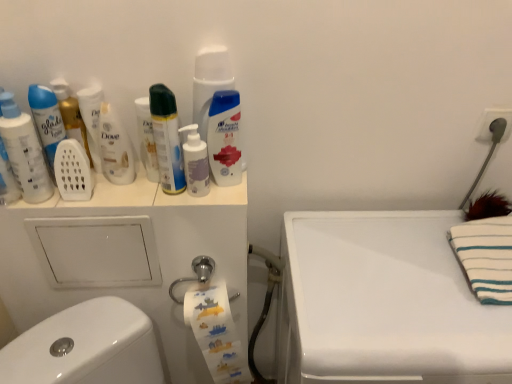
Measure the distance between white plastic electric outlet at upper right and camera.

They are 38.62 inches apart.

Find the location of a particular element. This screenshot has height=384, width=512. white striped towel at upper right is located at coordinates (486, 257).

Where is `matte white mouthwash at left, the 1th mouthwash from the left`? matte white mouthwash at left, the 1th mouthwash from the left is located at coordinates (24, 151).

What is the approximate width of white matte pump bottle at center, marked as the 2th mouthwash in a right-to-left arrangement?

The width of white matte pump bottle at center, marked as the 2th mouthwash in a right-to-left arrangement, is 2.26 inches.

Describe the element at coordinates (225, 138) in the screenshot. This screenshot has width=512, height=384. I see `translucent plastic mouthwash at center, positioned as the first mouthwash in right-to-left order` at that location.

Identify the location of white glossy counter top at upper right. (384, 303).

Where is `white plastic electric outlet at upper right`? white plastic electric outlet at upper right is located at coordinates (495, 123).

From the image's perspective, between white matte plastic mouthwash at upper left, placed as the 3th mouthwash when sorted from left to right, and white glossy counter top at upper right, who is located below?

white glossy counter top at upper right.

Is white matte plastic mouthwash at upper left, arranged as the fourth mouthwash when viewed from the right, turned away from white glossy counter top at upper right?

No, white matte plastic mouthwash at upper left, arranged as the fourth mouthwash when viewed from the right, is not facing away from white glossy counter top at upper right.

Is white glossy counter top at upper right inside white matte plastic mouthwash at upper left, placed as the 3th mouthwash when sorted from left to right?

Definitely not — white glossy counter top at upper right is not inside white matte plastic mouthwash at upper left, placed as the 3th mouthwash when sorted from left to right.

Is white matte plastic mouthwash at upper left, arranged as the fourth mouthwash when viewed from the right, taller than white glossy counter top at upper right?

Incorrect, the height of white matte plastic mouthwash at upper left, arranged as the fourth mouthwash when viewed from the right, is not larger of that of white glossy counter top at upper right.

From the image's perspective, does white glossy counter top at upper right appear higher than white matte pump bottle at center, the fifth mouthwash viewed from the left?

No, from the image's perspective, white glossy counter top at upper right is not over white matte pump bottle at center, the fifth mouthwash viewed from the left.

Is white glossy counter top at upper right oriented away from white matte pump bottle at center, marked as the 2th mouthwash in a right-to-left arrangement?

No, white glossy counter top at upper right's orientation is not away from white matte pump bottle at center, marked as the 2th mouthwash in a right-to-left arrangement.

Is white glossy counter top at upper right further to the viewer compared to white matte pump bottle at center, marked as the 2th mouthwash in a right-to-left arrangement?

That is False.

Consider the image. Considering the positions of objects white glossy counter top at upper right and white matte pump bottle at center, marked as the 2th mouthwash in a right-to-left arrangement, in the image provided, who is more to the right, white glossy counter top at upper right or white matte pump bottle at center, marked as the 2th mouthwash in a right-to-left arrangement,?

Positioned to the right is white glossy counter top at upper right.

From a real-world perspective, does white matte pump bottle at center, the fifth mouthwash viewed from the left, sit lower than white glossy toilet paper at center?

Actually, white matte pump bottle at center, the fifth mouthwash viewed from the left, is physically above white glossy toilet paper at center in the real world.

From the image's perspective, which one is positioned lower, white matte pump bottle at center, the fifth mouthwash viewed from the left, or white glossy toilet paper at center?

From the image's view, white glossy toilet paper at center is below.

In terms of height, does white matte pump bottle at center, the fifth mouthwash viewed from the left, look taller or shorter compared to white glossy toilet paper at center?

Clearly, white matte pump bottle at center, the fifth mouthwash viewed from the left, is shorter compared to white glossy toilet paper at center.

Based on the photo, which is more to the right, white matte pump bottle at center, the fifth mouthwash viewed from the left, or white glossy toilet paper at center?

white glossy toilet paper at center.

From a real-world perspective, is matte white mouthwash at left, arranged as the fifth mouthwash when viewed from the right, above or below white glossy toilet paper at center?

From a real-world perspective, matte white mouthwash at left, arranged as the fifth mouthwash when viewed from the right, is physically above white glossy toilet paper at center.

Can you confirm if matte white mouthwash at left, the second mouthwash positioned from the left, is wider than white glossy toilet paper at center?

No, matte white mouthwash at left, the second mouthwash positioned from the left, is not wider than white glossy toilet paper at center.

Based on their positions, is matte white mouthwash at left, arranged as the fifth mouthwash when viewed from the right, located to the left or right of white glossy toilet paper at center?

matte white mouthwash at left, arranged as the fifth mouthwash when viewed from the right, is positioned on white glossy toilet paper at center's left side.

From the image's perspective, relative to white glossy toilet paper at center, is matte white mouthwash at left, the second mouthwash positioned from the left, above or below?

matte white mouthwash at left, the second mouthwash positioned from the left, is above white glossy toilet paper at center.

Is white plastic electric outlet at upper right bigger than white matte pump bottle at center, the fifth mouthwash viewed from the left?

No.

Does white plastic electric outlet at upper right have a greater width compared to white matte pump bottle at center, marked as the 2th mouthwash in a right-to-left arrangement?

No.

Considering the relative positions of white plastic electric outlet at upper right and white matte pump bottle at center, marked as the 2th mouthwash in a right-to-left arrangement, in the image provided, is white plastic electric outlet at upper right to the left or to the right of white matte pump bottle at center, marked as the 2th mouthwash in a right-to-left arrangement,?

Clearly, white plastic electric outlet at upper right is on the right of white matte pump bottle at center, marked as the 2th mouthwash in a right-to-left arrangement, in the image.

Is white plastic electric outlet at upper right in front of or behind white matte pump bottle at center, marked as the 2th mouthwash in a right-to-left arrangement, in the image?

white plastic electric outlet at upper right is positioned farther from the viewer than white matte pump bottle at center, marked as the 2th mouthwash in a right-to-left arrangement.

In the image, is white striped towel at upper right on the left side or the right side of matte white mouthwash at left, arranged as the fifth mouthwash when viewed from the right?

In the image, white striped towel at upper right appears on the right side of matte white mouthwash at left, arranged as the fifth mouthwash when viewed from the right.

Is white striped towel at upper right spatially inside matte white mouthwash at left, arranged as the fifth mouthwash when viewed from the right, or outside of it?

The correct answer is: outside.

Considering the sizes of objects white striped towel at upper right and matte white mouthwash at left, arranged as the fifth mouthwash when viewed from the right, in the image provided, who is taller, white striped towel at upper right or matte white mouthwash at left, arranged as the fifth mouthwash when viewed from the right,?

matte white mouthwash at left, arranged as the fifth mouthwash when viewed from the right, is taller.

Considering the sizes of matte white mouthwash at left, arranged as the fifth mouthwash when viewed from the right, and white plastic electric outlet at upper right in the image, is matte white mouthwash at left, arranged as the fifth mouthwash when viewed from the right, wider or thinner than white plastic electric outlet at upper right?

Considering their sizes, matte white mouthwash at left, arranged as the fifth mouthwash when viewed from the right, looks broader than white plastic electric outlet at upper right.

From a real-world perspective, between matte white mouthwash at left, the second mouthwash positioned from the left, and white plastic electric outlet at upper right, who is vertically lower?

white plastic electric outlet at upper right, from a real-world perspective.

The width and height of the screenshot is (512, 384). I want to click on electric outlet above the matte white mouthwash at left, the second mouthwash positioned from the left (from the image's perspective), so click(495, 123).

From the image's perspective, does matte white mouthwash at left, the second mouthwash positioned from the left, appear lower than white plastic electric outlet at upper right?

Yes.

In the image, there is a white matte plastic mouthwash at upper left, placed as the 3th mouthwash when sorted from left to right. At what (x,y) coordinates should I click in order to perform the action: click on counter top below it (from the image's perspective). Please return your answer as a coordinate pair (x, y). Looking at the image, I should click on (384, 303).

Locate an element on the screen. This screenshot has height=384, width=512. counter top lying in front of the white matte pump bottle at center, the fifth mouthwash viewed from the left is located at coordinates (384, 303).

Looking at this image, which object lies nearer to the anchor point white matte plastic mouthwash at upper left, placed as the 3th mouthwash when sorted from left to right, translucent plastic mouthwash at center, the fourth mouthwash in the left-to-right sequence, or translucent plastic mouthwash at center, the sixth mouthwash from the left?

Based on the image, translucent plastic mouthwash at center, the fourth mouthwash in the left-to-right sequence, appears to be nearer to white matte plastic mouthwash at upper left, placed as the 3th mouthwash when sorted from left to right.

Estimate the real-world distances between objects in this image. Which object is further from white matte pump bottle at center, marked as the 2th mouthwash in a right-to-left arrangement, matte white mouthwash at left, the sixth mouthwash in the right-to-left sequence, or matte white mouthwash at left, the second mouthwash positioned from the left?

Among the two, matte white mouthwash at left, the sixth mouthwash in the right-to-left sequence, is located further to white matte pump bottle at center, marked as the 2th mouthwash in a right-to-left arrangement.

Based on the photo, considering their positions, is white matte plastic mouthwash at upper left, placed as the 3th mouthwash when sorted from left to right, positioned closer to white striped towel at upper right than matte white mouthwash at left, the 1th mouthwash from the left?

white matte plastic mouthwash at upper left, placed as the 3th mouthwash when sorted from left to right.

Which object lies further to the anchor point matte white mouthwash at left, the 1th mouthwash from the left, matte white mouthwash at left, arranged as the fifth mouthwash when viewed from the right, or white glossy counter top at upper right?

Among the two, white glossy counter top at upper right is located further to matte white mouthwash at left, the 1th mouthwash from the left.

In the scene shown: Estimate the real-world distances between objects in this image. Which object is closer to matte white mouthwash at left, the sixth mouthwash in the right-to-left sequence, translucent plastic mouthwash at center, the sixth mouthwash from the left, or translucent plastic mouthwash at center, the 3th mouthwash positioned from the right?

translucent plastic mouthwash at center, the 3th mouthwash positioned from the right.

When comparing their distances from white striped towel at upper right, does matte white mouthwash at left, the second mouthwash positioned from the left, or white matte plastic mouthwash at upper left, placed as the 3th mouthwash when sorted from left to right, seem further?

matte white mouthwash at left, the second mouthwash positioned from the left.

Considering their positions, is translucent plastic mouthwash at center, the 3th mouthwash positioned from the right, positioned further to white matte plastic mouthwash at upper left, placed as the 3th mouthwash when sorted from left to right, than white glossy toilet paper at center?

Among the two, white glossy toilet paper at center is located further to white matte plastic mouthwash at upper left, placed as the 3th mouthwash when sorted from left to right.

Which object lies nearer to the anchor point white glossy toilet paper at center, matte white mouthwash at left, the second mouthwash positioned from the left, or white matte pump bottle at center, the fifth mouthwash viewed from the left?

Based on the image, white matte pump bottle at center, the fifth mouthwash viewed from the left, appears to be nearer to white glossy toilet paper at center.

This screenshot has height=384, width=512. Find the location of `beach towel between white glossy toilet paper at center and white plastic electric outlet at upper right from left to right`. beach towel between white glossy toilet paper at center and white plastic electric outlet at upper right from left to right is located at coordinates (486, 257).

This screenshot has height=384, width=512. What are the coordinates of `mouthwash between white matte pump bottle at center, marked as the 2th mouthwash in a right-to-left arrangement, and white plastic electric outlet at upper right` in the screenshot? It's located at (225, 138).

Locate an element on the screen. beach towel located between translucent plastic mouthwash at center, the fourth mouthwash in the left-to-right sequence, and white plastic electric outlet at upper right in the left-right direction is located at coordinates (486, 257).

The height and width of the screenshot is (384, 512). I want to click on beach towel situated between white matte pump bottle at center, the fifth mouthwash viewed from the left, and white plastic electric outlet at upper right from left to right, so click(486, 257).